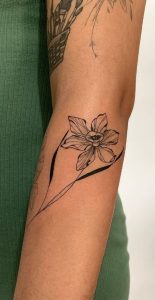
The height and width of the screenshot is (300, 155). Find the location of `basket`. basket is located at coordinates (57, 52).